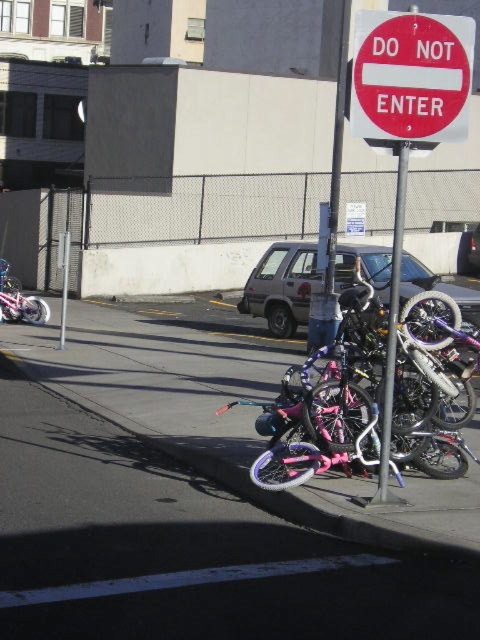
You are a delivery person who needs to place a package between the pink matte bicycle at center and the red matte sign at upper center. The package requires 6 feet of space. Can you fit it there?

The pink matte bicycle at center is 7.36 feet away from the red matte sign at upper center, so yes, the package requiring 6 feet of space can fit between them since there is enough distance.

You are a delivery person who needs to load a package onto a pink metallic bicycle at center. The loading area on the bicycle is 0.2 meters wide. Can you place the package at the point marked by the coordinates point (197, 500)?

The pink metallic bicycle at center is located at point (197, 500). Since the loading area is 0.2 meters wide, the package can be placed at that point as long as it fits within the width. However, without knowing the exact dimensions of the package, it is impossible to confirm if it will fit. Please ensure the package is within the 0.2 meters width limit.

You are a delivery person trying to park your pink matte bicycle at center near the curb. The curb has a white painted section that is 0.5 meters wide. Can you park your bicycle within the white section if the bicycle requires 0.7 meters of space?

The pink matte bicycle at center requires 0.7 meters of space, but the white section of the curb is only 0.5 meters wide. Therefore, the bicycle cannot fit within the white section.